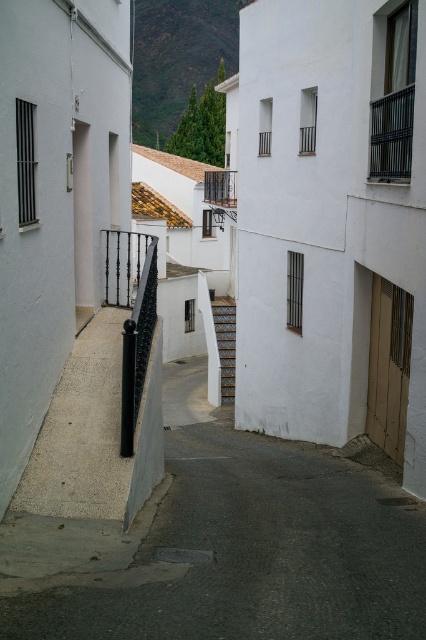
You are a tourist carrying a heavy backpack and want to climb up the wooden staircase at center. However, you notice the black metal balustrade at center nearby. Is the balustrade above or below the staircase?

The wooden staircase at center is located below the black metal balustrade at center, so the balustrade is above the staircase.

You are standing at the entrance of the alley and want to take the wooden staircase at center to reach the upper part of the alley. However, there is a black metal balustrade at center in your path. Based on the scene, can you step over the balustrade to access the staircase?

The wooden staircase at center is closer to the viewer than the black metal balustrade at center, so you can step over the balustrade to reach the staircase since it is behind the balustrade.